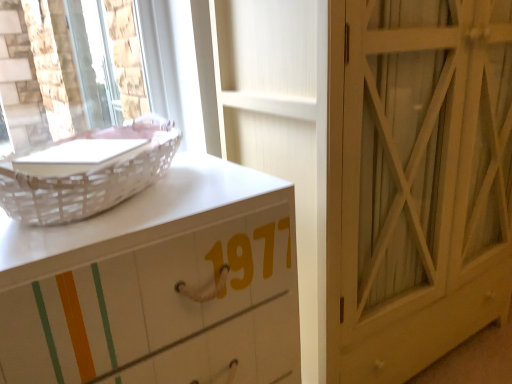
Question: Considering the relative sizes of white wicker basket at upper left and white painted wood chest of drawers at left in the image provided, is white wicker basket at upper left taller than white painted wood chest of drawers at left?

Choices:
 (A) no
 (B) yes

Answer: (A)

Question: Considering the relative sizes of white wicker basket at upper left and white painted wood chest of drawers at left in the image provided, is white wicker basket at upper left shorter than white painted wood chest of drawers at left?

Choices:
 (A) yes
 (B) no

Answer: (A)

Question: Does white wicker basket at upper left appear on the right side of white painted wood chest of drawers at left?

Choices:
 (A) yes
 (B) no

Answer: (B)

Question: Can you confirm if white wicker basket at upper left is positioned to the left of white painted wood chest of drawers at left?

Choices:
 (A) yes
 (B) no

Answer: (A)

Question: From the image's perspective, is white wicker basket at upper left above white painted wood chest of drawers at left?

Choices:
 (A) no
 (B) yes

Answer: (B)

Question: Is white wicker basket at upper left not near white painted wood chest of drawers at left?

Choices:
 (A) yes
 (B) no

Answer: (B)

Question: Does white painted wood chest of drawers at left have a lesser width compared to white wicker basket at upper left?

Choices:
 (A) yes
 (B) no

Answer: (B)

Question: Is the depth of white painted wood chest of drawers at left greater than that of white wicker basket at upper left?

Choices:
 (A) yes
 (B) no

Answer: (B)

Question: Is white painted wood chest of drawers at left smaller than white wicker basket at upper left?

Choices:
 (A) yes
 (B) no

Answer: (B)

Question: Are white painted wood chest of drawers at left and white wicker basket at upper left making contact?

Choices:
 (A) yes
 (B) no

Answer: (B)

Question: From a real-world perspective, is white painted wood chest of drawers at left under white wicker basket at upper left?

Choices:
 (A) no
 (B) yes

Answer: (B)

Question: Does white painted wood chest of drawers at left appear on the right side of white wicker basket at upper left?

Choices:
 (A) no
 (B) yes

Answer: (B)

Question: Is white wood door at center-right outside of white painted wood chest of drawers at left?

Choices:
 (A) no
 (B) yes

Answer: (B)